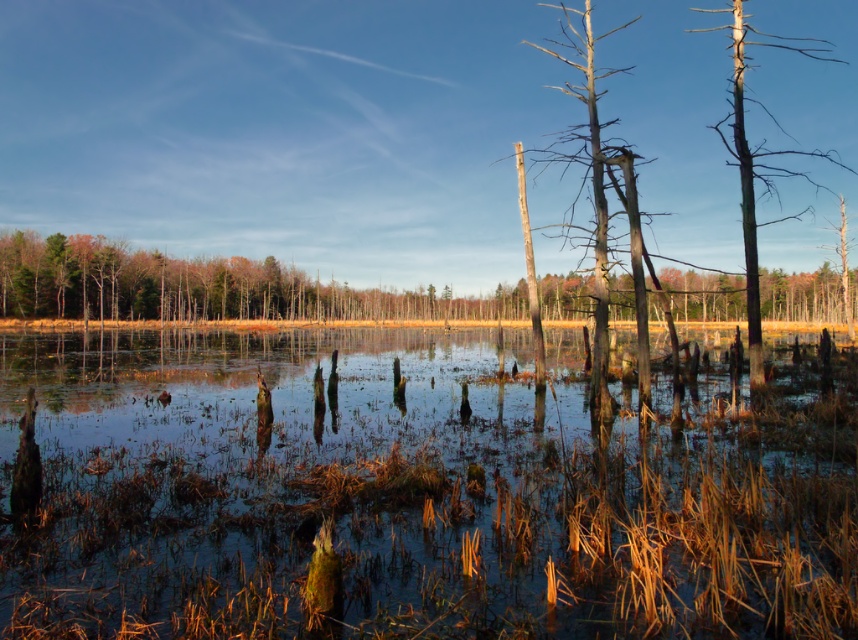
Between brown wood tree at center and dark brown wood tree at upper right, which one is positioned higher?

brown wood tree at center is higher up.

Is point (639, 368) farther from camera compared to point (747, 230)?

No, (639, 368) is closer to viewer.

Measure the distance between brown wood tree at center and camera.

They are 14.06 meters apart.

At what (x,y) coordinates should I click in order to perform the action: click on brown wood tree at center. Please return your answer as a coordinate pair (x, y). Image resolution: width=858 pixels, height=640 pixels. Looking at the image, I should click on (606, 221).

Between clear water at center and dark brown wood tree at upper right, which one appears on the left side from the viewer's perspective?

clear water at center is more to the left.

Is clear water at center wider than dark brown wood tree at upper right?

No, clear water at center is not wider than dark brown wood tree at upper right.

Does point (786, 420) come behind point (757, 371)?

No, (786, 420) is closer to viewer.

This screenshot has width=858, height=640. In order to click on clear water at center in this screenshot , I will do `click(414, 492)`.

Which of these two, clear water at center or brown wood tree at center, stands taller?

With more height is brown wood tree at center.

Between point (153, 552) and point (618, 164), which one is positioned behind?

Positioned behind is point (618, 164).

Find the location of `clear water at center`. clear water at center is located at coordinates (414, 492).